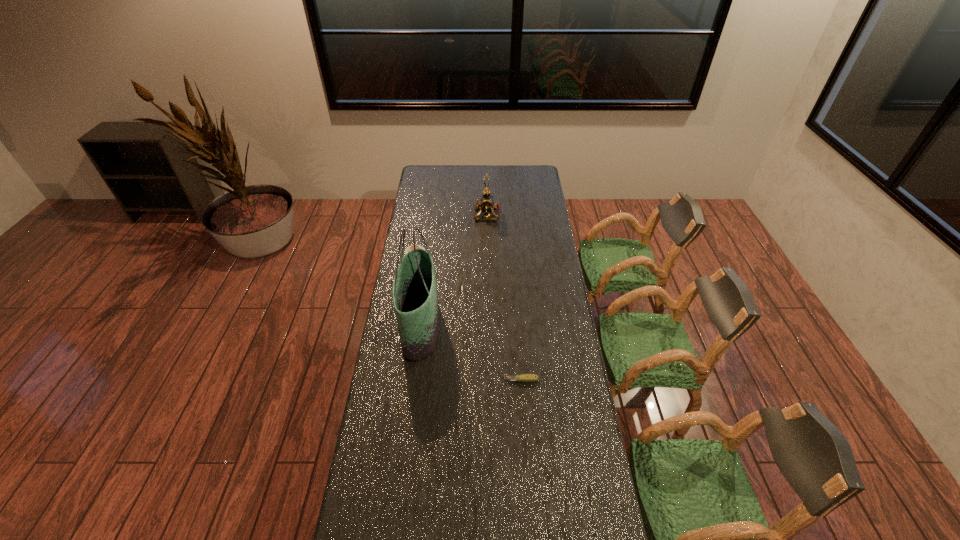
Find the location of a particular element. The image size is (960, 540). the closest object to the second tallest object is located at coordinates (409, 248).

Select which object appears as the third closest to the telephone. Please provide its 2D coordinates. Your answer should be formatted as a tuple, i.e. [(x, y)], where the tuple contains the x and y coordinates of a point satisfying the conditions above.

[(525, 378)]

You are a GUI agent. You are given a task and a screenshot of the screen. Output one action in this format:
    pyautogui.click(x=<x>, y=<y>)
    Task: Click on the free space that satisfies the following two spatial constraints: 1. on the front side of the pocketknife; 2. on the left side of the second shortest object
    This screenshot has height=540, width=960.
    Given the screenshot: What is the action you would take?
    pyautogui.click(x=395, y=380)

At what (x,y) coordinates should I click in order to perform the action: click on vacant area in the image that satisfies the following two spatial constraints: 1. on the front of the third shortest object, featuring the rotary dial; 2. on the left side of the pocketknife. Please return your answer as a coordinate pair (x, y). This screenshot has height=540, width=960. Looking at the image, I should click on (490, 380).

Where is `blank area in the image that satisfies the following two spatial constraints: 1. on the front of the farthest object, featuring the rotary dial; 2. on the back side of the shortest object`? This screenshot has width=960, height=540. blank area in the image that satisfies the following two spatial constraints: 1. on the front of the farthest object, featuring the rotary dial; 2. on the back side of the shortest object is located at coordinates (490, 380).

What are the coordinates of `free region that satisfies the following two spatial constraints: 1. on the front of the farthest object, featuring the rotary dial; 2. on the back side of the pocketknife` in the screenshot? It's located at (490, 380).

I want to click on vacant position in the image that satisfies the following two spatial constraints: 1. on the front of the shortest object, featuring the rotary dial; 2. on the left side of the second tallest object, so click(490, 380).